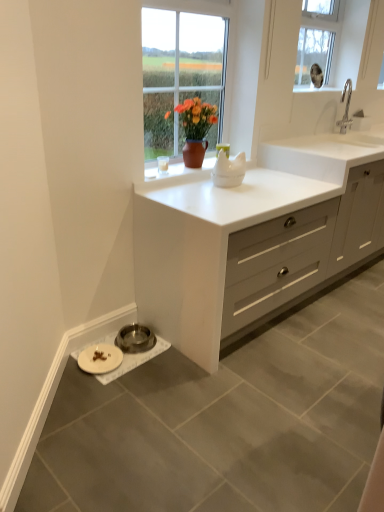
Question: Based on their sizes in the image, would you say white matte cabinet at center is bigger or smaller than white matte plate at lower left?

Choices:
 (A) small
 (B) big

Answer: (B)

Question: Which is correct: white matte cabinet at center is inside white matte plate at lower left, or outside of it?

Choices:
 (A) inside
 (B) outside

Answer: (B)

Question: Estimate the real-world distances between objects in this image. Which object is closer to the white glossy cat-shaped object at center, marked as the second appliance in a left-to-right arrangement?

Choices:
 (A) white matte cabinet at center
 (B) white ceramic sink at upper right
 (C) clear glass window at upper center
 (D) metallic stainless steel bowl at lower left, the second appliance from the right
 (E) white matte plate at lower left

Answer: (A)

Question: Based on their relative distances, which object is nearer to the white matte plate at lower left?

Choices:
 (A) clear glass window at upper center
 (B) metallic stainless steel bowl at lower left, which is counted as the second appliance, starting from the top
 (C) white glossy cat-shaped object at center, which is the first appliance in right-to-left order
 (D) white matte cabinet at center
 (E) white ceramic sink at upper right

Answer: (B)